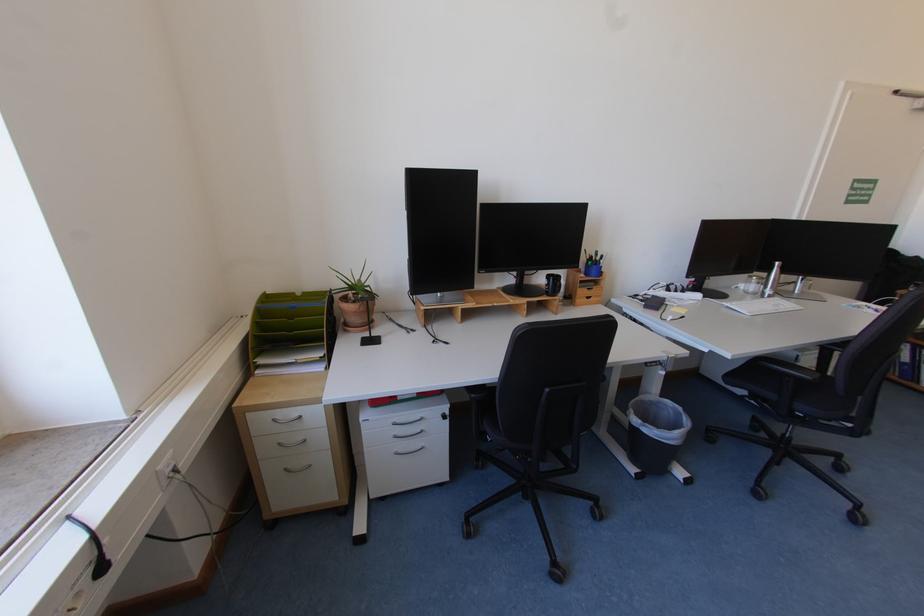
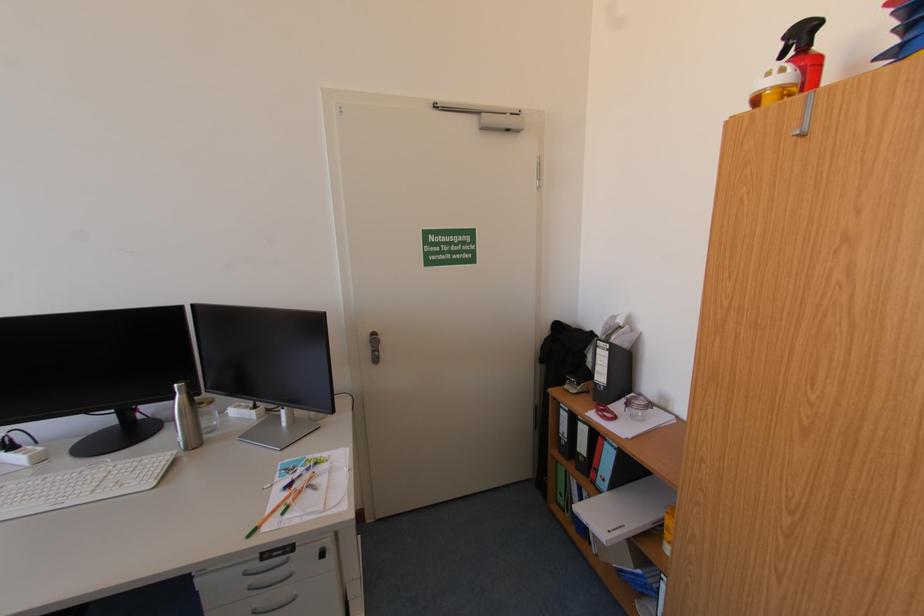
Question: In a continuous first-person perspective shot, in which direction is the camera moving?

Choices:
 (A) Left
 (B) Right
 (C) Forward
 (D) Backward

Answer: (B)